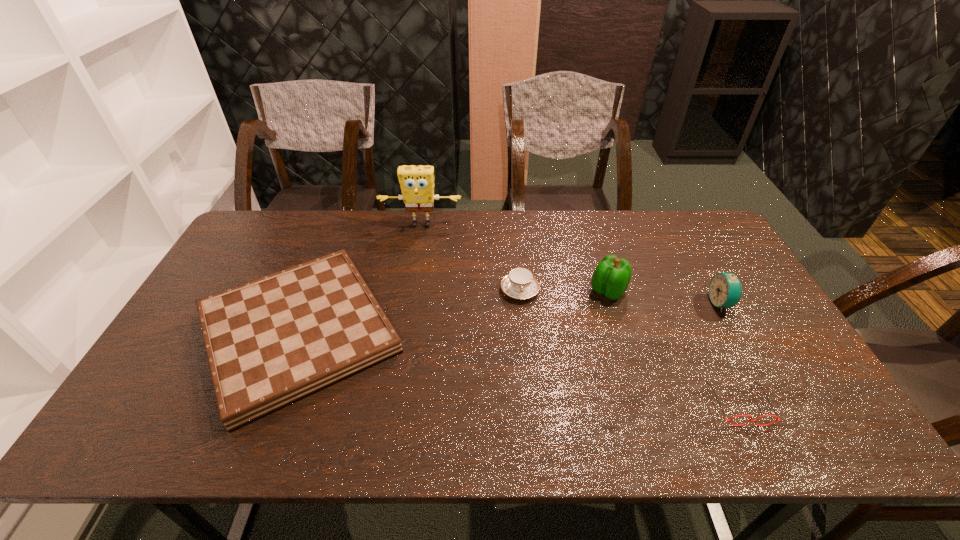
This screenshot has width=960, height=540. Find the location of `vacant space situated on the front-facing side of the alarm clock`. vacant space situated on the front-facing side of the alarm clock is located at coordinates (624, 303).

Identify the location of vacant space located 0.370m on the front-facing side of the alarm clock. The width and height of the screenshot is (960, 540). (584, 303).

Identify the location of free space located on the side with the handle of the third object from left to right. (533, 433).

Locate an element on the screen. This screenshot has width=960, height=540. vacant space located on the back of the gameboard is located at coordinates (332, 246).

The height and width of the screenshot is (540, 960). I want to click on object situated at the far edge, so click(417, 182).

At what (x,y) coordinates should I click in order to perform the action: click on gameboard present at the near edge. Please return your answer as a coordinate pair (x, y). This screenshot has width=960, height=540. Looking at the image, I should click on (273, 341).

Find the location of a particular element. This screenshot has height=540, width=960. spectacles that is positioned at the near edge is located at coordinates click(x=755, y=421).

You are a GUI agent. You are given a task and a screenshot of the screen. Output one action in this format:
    pyautogui.click(x=<x>, y=<y>)
    Task: Click on the object at the left edge
    
    Given the screenshot: What is the action you would take?
    pyautogui.click(x=273, y=341)

Where is `alarm clock at the right edge`? alarm clock at the right edge is located at coordinates (725, 290).

Where is `spectacles that is at the right edge`? spectacles that is at the right edge is located at coordinates (755, 421).